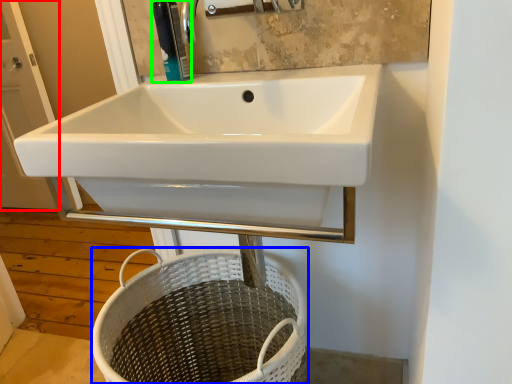
Question: Which is farther away from screen door (highlighted by a red box)? basket (highlighted by a blue box) or soap dispenser (highlighted by a green box)?

Choices:
 (A) basket
 (B) soap dispenser

Answer: (B)